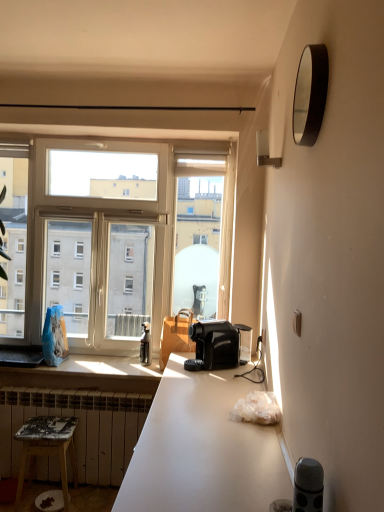
Locate an element on the screen. This screenshot has width=384, height=512. free spot above white painted metal radiator at lower left (from a real-world perspective) is located at coordinates (77, 386).